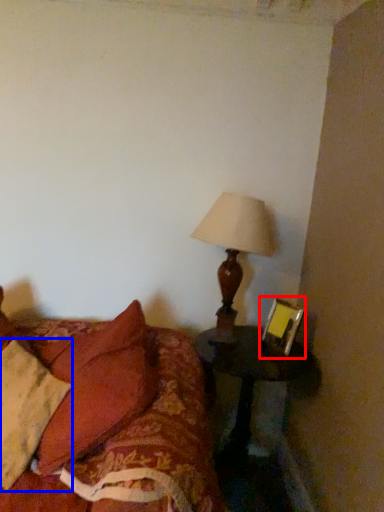
Question: Which object appears closest to the camera in this image, picture frame (highlighted by a red box) or pillow (highlighted by a blue box)?

Choices:
 (A) picture frame
 (B) pillow

Answer: (B)